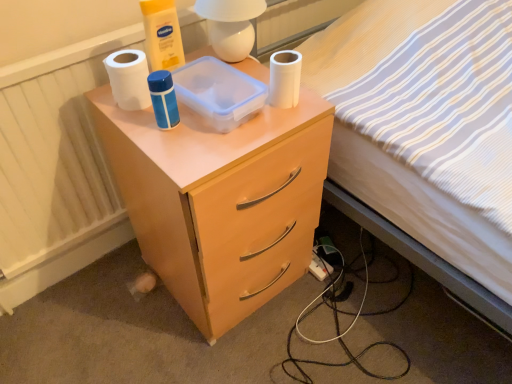
I want to click on vacant area that is in front of transparent plastic container at upper center, so click(205, 149).